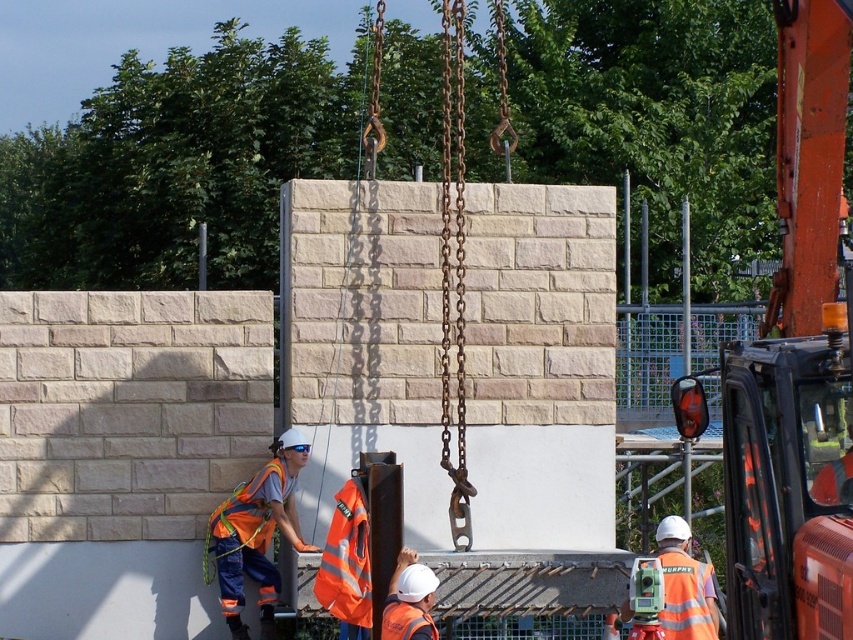
Is reflective orange safety vest at center to the right of orange reflective safety vest at lower left from the viewer's perspective?

Correct, you'll find reflective orange safety vest at center to the right of orange reflective safety vest at lower left.

Who is lower down, reflective orange safety vest at center or orange reflective safety vest at lower left?

reflective orange safety vest at center

Who is more forward, (236, 556) or (270, 529)?

Point (236, 556) is in front.

I want to click on reflective orange safety vest at center, so click(x=256, y=532).

Is reflective orange vest at center thinner than orange reflective safety vest at lower left?

Correct, reflective orange vest at center's width is less than orange reflective safety vest at lower left's.

Can you confirm if reflective orange vest at center is bigger than orange reflective safety vest at lower left?

Correct, reflective orange vest at center is larger in size than orange reflective safety vest at lower left.

Identify the location of reflective orange vest at center. This screenshot has width=853, height=640. (683, 586).

Find the location of a particular element. The image size is (853, 640). reflective orange vest at center is located at coordinates (683, 586).

Which is above, reflective orange safety vest at center or reflective orange vest at center?

reflective orange safety vest at center

Is reflective orange safety vest at center thinner than reflective orange vest at center?

No.

Identify the location of reflective orange safety vest at center. (256, 532).